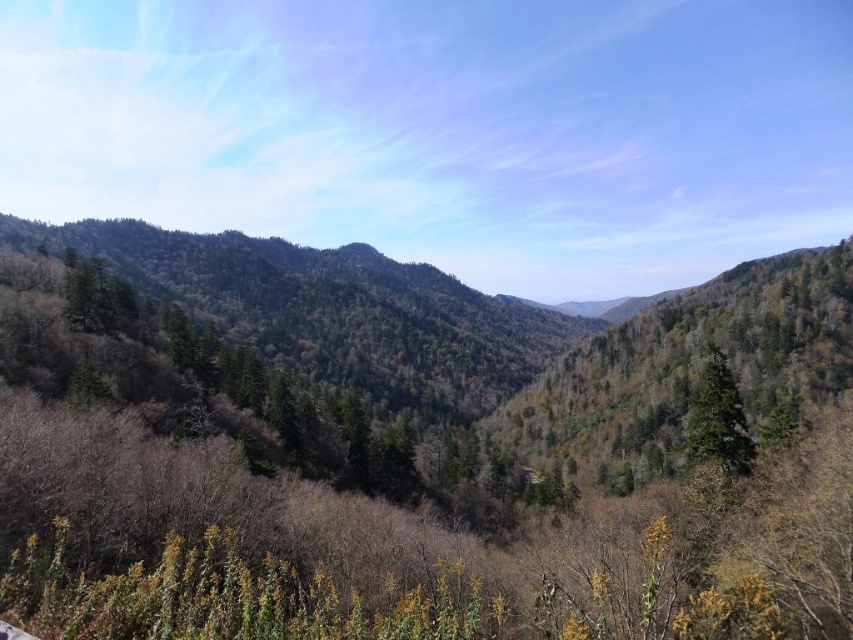
What are the coordinates of the green textured forest at center?

The green textured forest at center is located at coordinates point (495, 336).